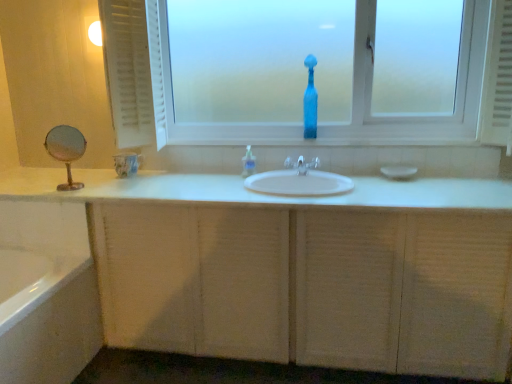
At what (x,y) coordinates should I click in order to perform the action: click on vacant region above white matte soap at center (from a real-world perspective). Please return your answer as a coordinate pair (x, y). Looking at the image, I should click on (400, 160).